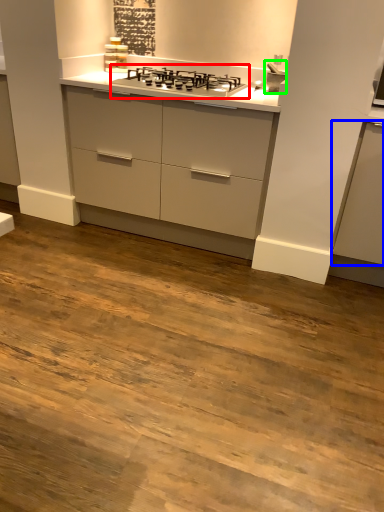
Question: Estimate the real-world distances between objects in this image. Which object is farther from gas stove (highlighted by a red box), cabinetry (highlighted by a blue box) or sink (highlighted by a green box)?

Choices:
 (A) cabinetry
 (B) sink

Answer: (A)